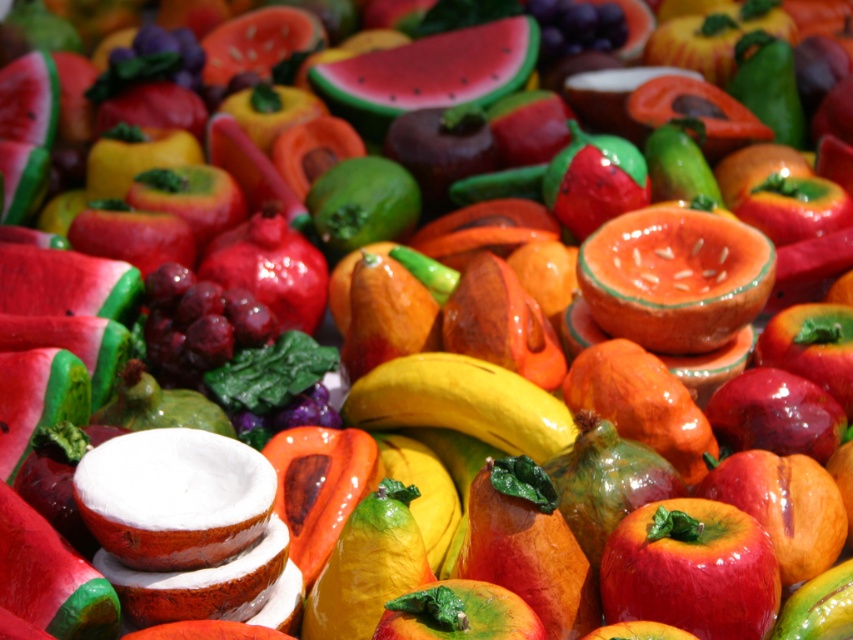
The width and height of the screenshot is (853, 640). What do you see at coordinates (691, 570) in the screenshot? I see `shiny red apple at center` at bounding box center [691, 570].

In the scene shown: Is shiny red apple at center in front of smooth red watermelon at center?

Yes, it is in front of smooth red watermelon at center.

Find the location of a particular element. shiny red apple at center is located at coordinates (691, 570).